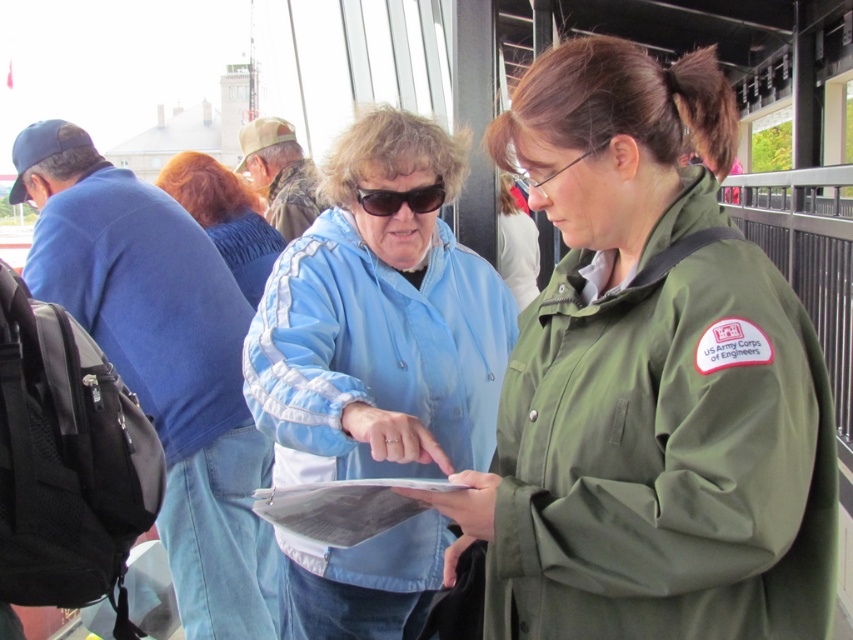
You are standing at the point labeled point(225, 216). What object are you on?

The point labeled point(225, 216) is on the blue fabric jacket at upper center.

You are a photographer at the event and need to capture a clear shot of the metallic gray clipboard at center without the blue fabric jacket at upper center blocking it. What adjustment should you make to your camera angle?

The blue fabric jacket at upper center is positioned over the metallic gray clipboard at center, so to avoid blocking, you should lower your camera angle to capture the clipboard below the jacket.